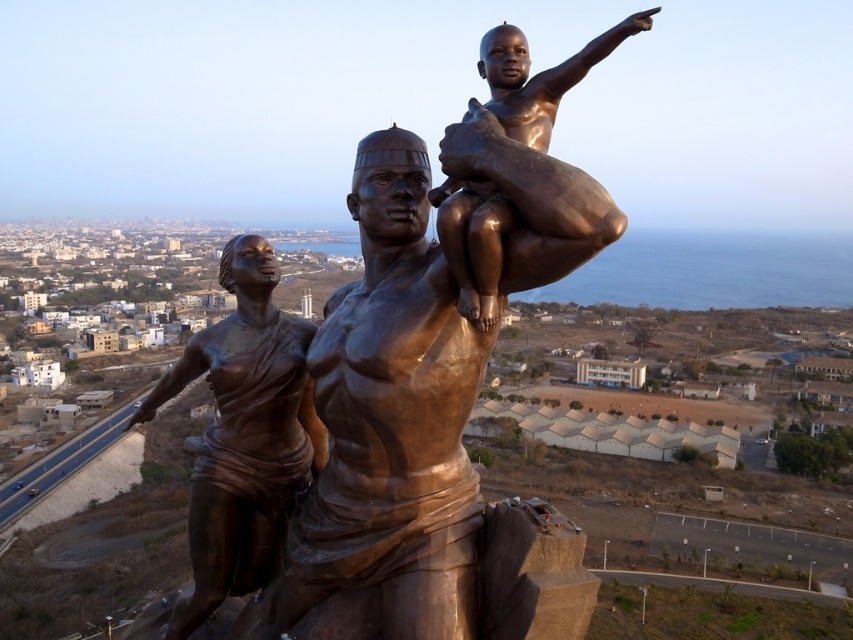
Is bronze statue at center smaller than shiny bronze statue at left?

No, bronze statue at center is not smaller than shiny bronze statue at left.

Who is more forward, (463, 348) or (251, 509)?

Positioned in front is point (463, 348).

Image resolution: width=853 pixels, height=640 pixels. I want to click on bronze statue at center, so pos(428,349).